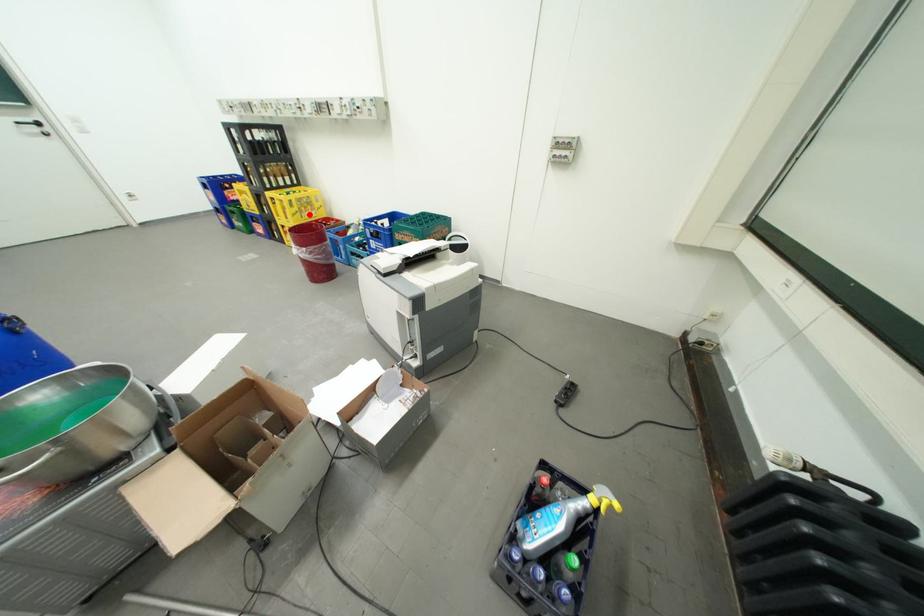
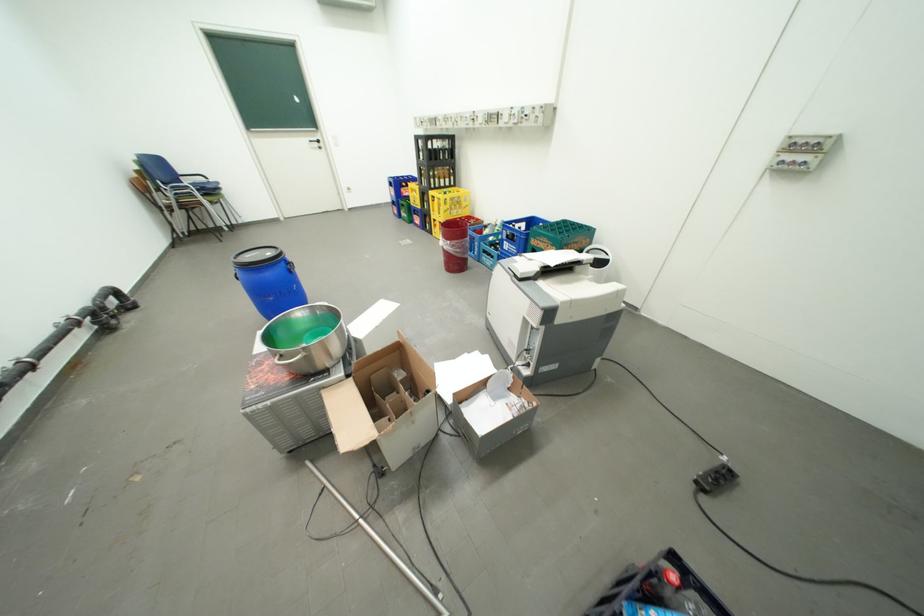
In the second image, find the point that corresponds to the highlighted location in the first image.

(459, 212)